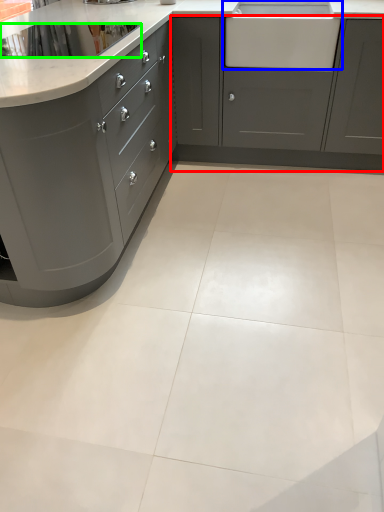
Question: Estimate the real-world distances between objects in this image. Which object is farther from cabinetry (highlighted by a red box), sink (highlighted by a blue box) or appliance (highlighted by a green box)?

Choices:
 (A) sink
 (B) appliance

Answer: (B)